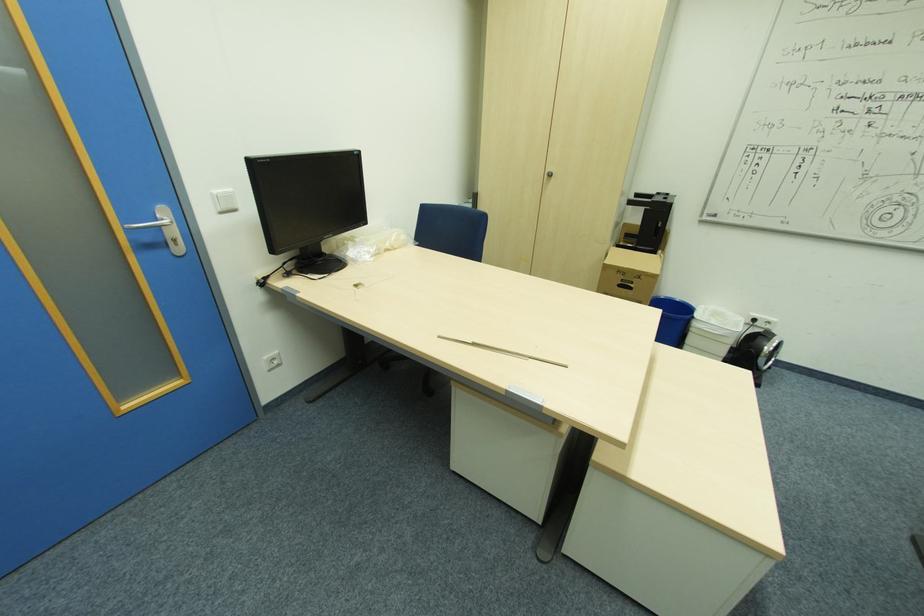
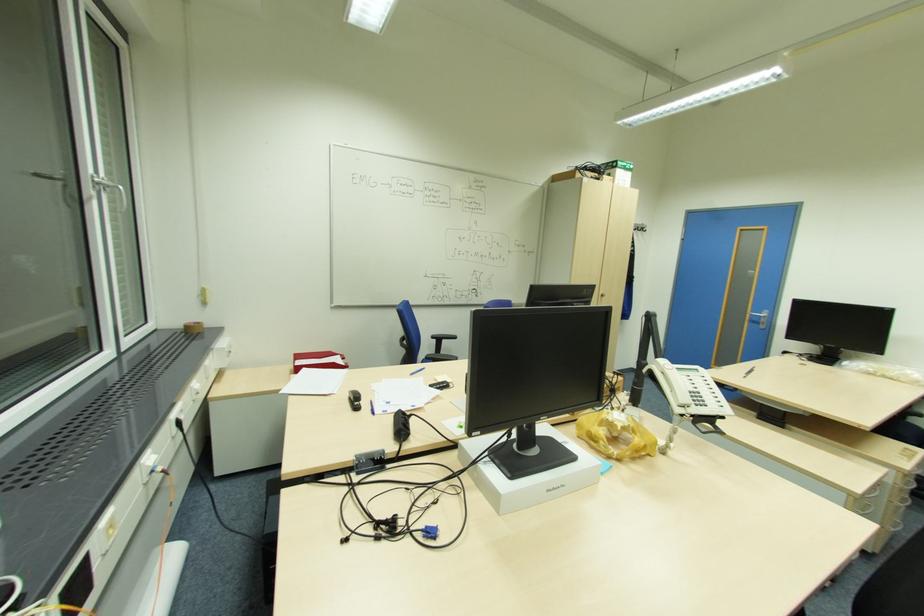
In the second image, find the point that corresponds to the point at 176,240 in the first image.

(766, 323)